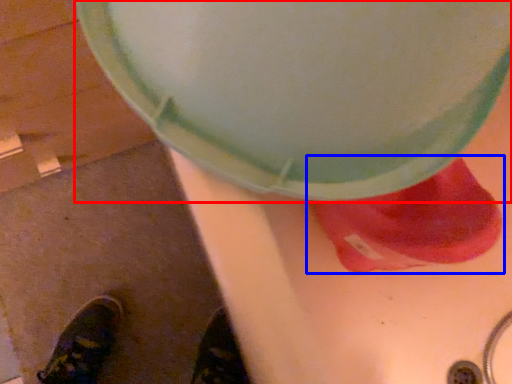
Question: Among these objects, which one is farthest to the camera, lid (highlighted by a red box) or footwear (highlighted by a blue box)?

Choices:
 (A) lid
 (B) footwear

Answer: (B)